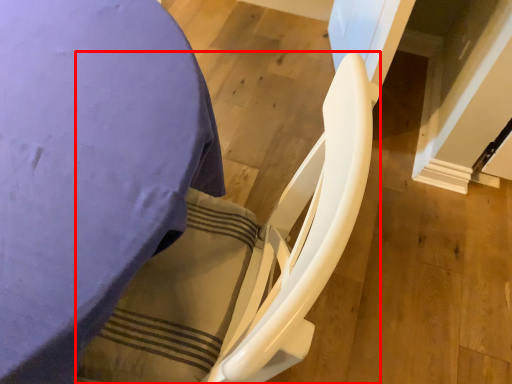
Question: From the image's perspective, what is the correct spatial positioning of rocking chair (annotated by the red box) in reference to furniture?

Choices:
 (A) below
 (B) above

Answer: (A)